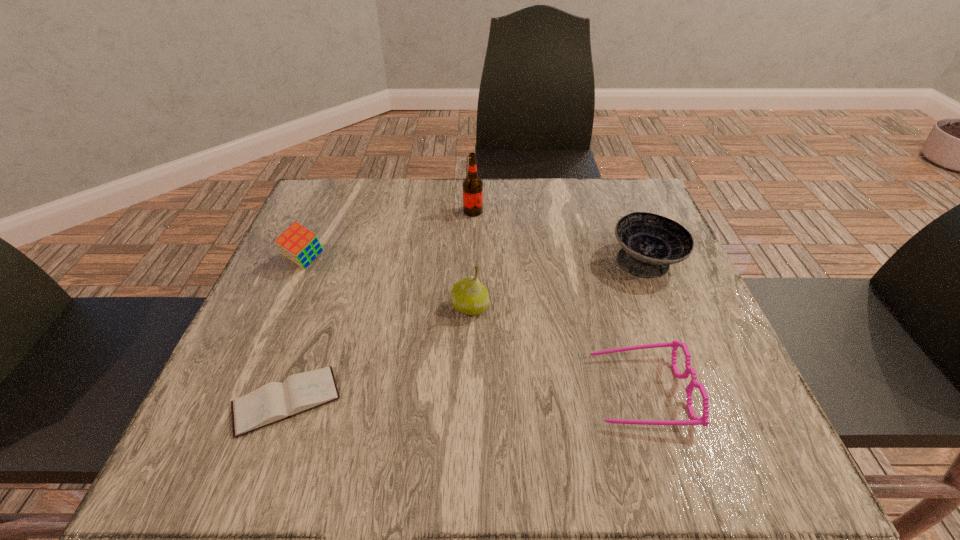
In the image, there is a desktop. At what (x,y) coordinates should I click in order to perform the action: click on free space at the far right corner. Please return your answer as a coordinate pair (x, y). This screenshot has height=540, width=960. Looking at the image, I should click on (x=585, y=185).

Find the location of a particular element. The image size is (960, 540). free space between the shortest object and the bowl is located at coordinates (466, 331).

The image size is (960, 540). In order to click on free point between the root beer and the cube in this screenshot , I will do `click(389, 236)`.

At what (x,y) coordinates should I click in order to perform the action: click on unoccupied position between the cube and the farthest object. Please return your answer as a coordinate pair (x, y). The width and height of the screenshot is (960, 540). Looking at the image, I should click on (389, 236).

Where is `empty space that is in between the third nearest object and the cube`? The width and height of the screenshot is (960, 540). empty space that is in between the third nearest object and the cube is located at coordinates (388, 284).

Image resolution: width=960 pixels, height=540 pixels. Identify the location of free space between the diary and the tallest object. (379, 306).

Where is `free space between the fourth farthest object and the cube`? The width and height of the screenshot is (960, 540). free space between the fourth farthest object and the cube is located at coordinates (388, 284).

Where is `free point between the bowl and the diary`? The width and height of the screenshot is (960, 540). free point between the bowl and the diary is located at coordinates (466, 331).

The image size is (960, 540). In order to click on free space between the second tallest object and the spectacles in this screenshot , I will do [x=555, y=349].

Where is `blank region between the diary and the root beer`? blank region between the diary and the root beer is located at coordinates (379, 306).